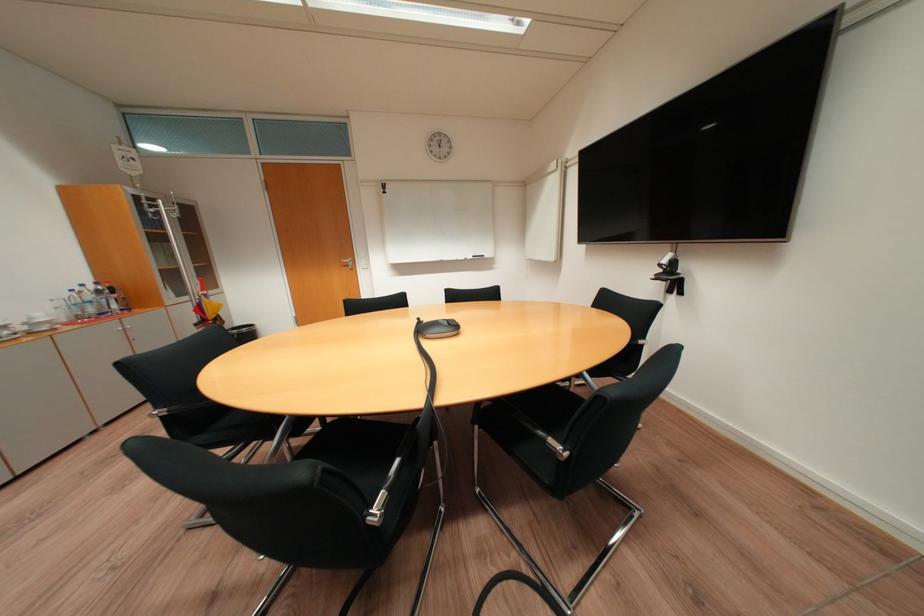
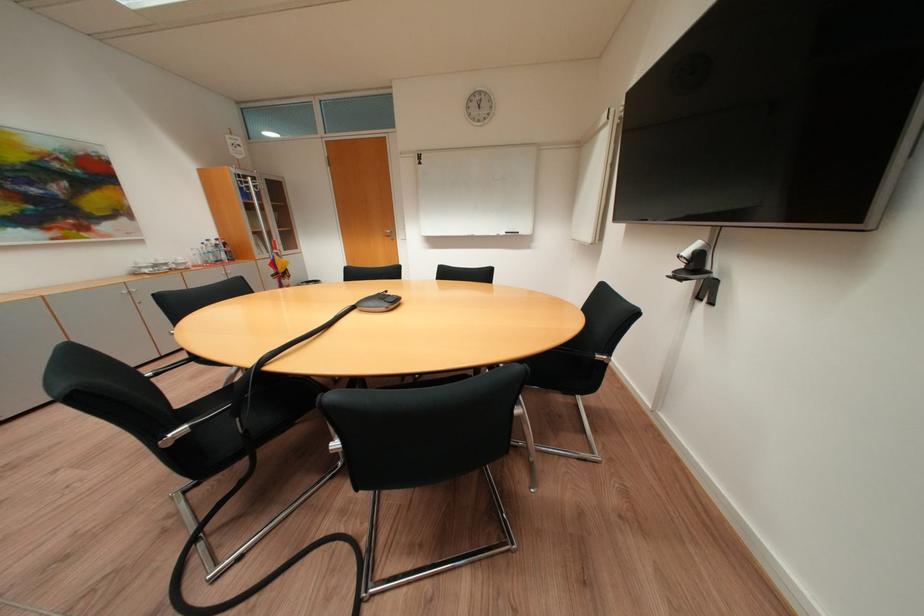
Question: In a continuous first-person perspective shot, in which direction is the camera moving?

Choices:
 (A) Left
 (B) Right
 (C) Forward
 (D) Backward

Answer: (B)